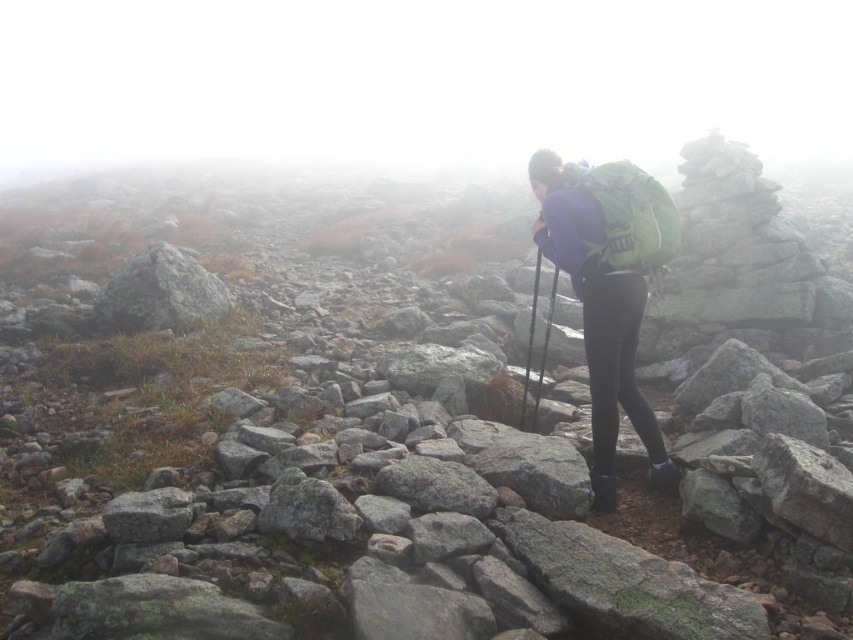
Question: Which of the following is the closest to the observer?

Choices:
 (A) (587, 172)
 (B) (119, 307)

Answer: (A)

Question: Can you confirm if matte purple jacket at center is smaller than gray rough rock at left?

Choices:
 (A) no
 (B) yes

Answer: (A)

Question: Which point is closer to the camera?

Choices:
 (A) gray rough rock at left
 (B) matte purple jacket at center

Answer: (B)

Question: Can you confirm if matte purple jacket at center is positioned to the left of gray rough rock at left?

Choices:
 (A) yes
 (B) no

Answer: (B)

Question: Which object appears farthest from the camera in this image?

Choices:
 (A) gray rough rock at left
 (B) matte purple jacket at center

Answer: (A)

Question: Can you confirm if matte purple jacket at center is wider than gray rough rock at left?

Choices:
 (A) yes
 (B) no

Answer: (B)